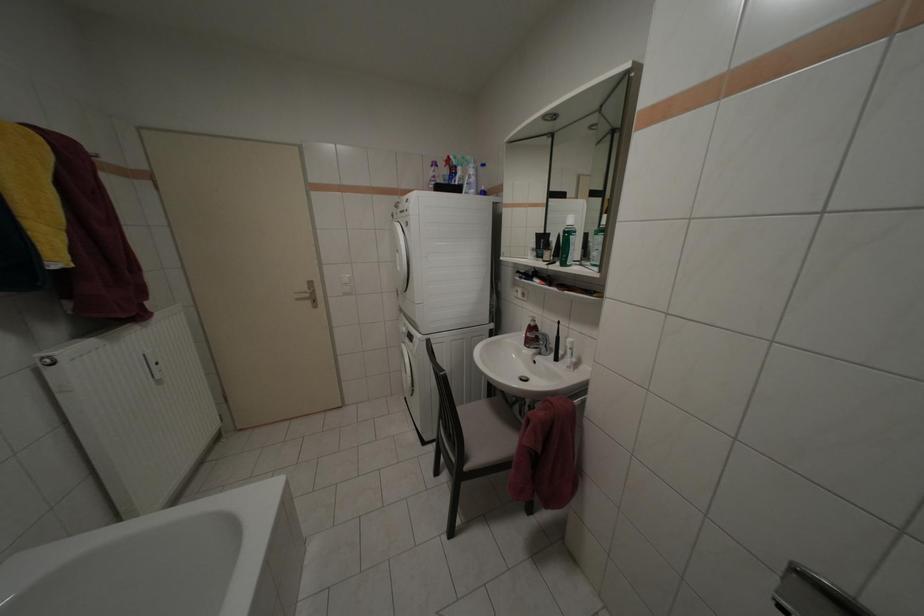
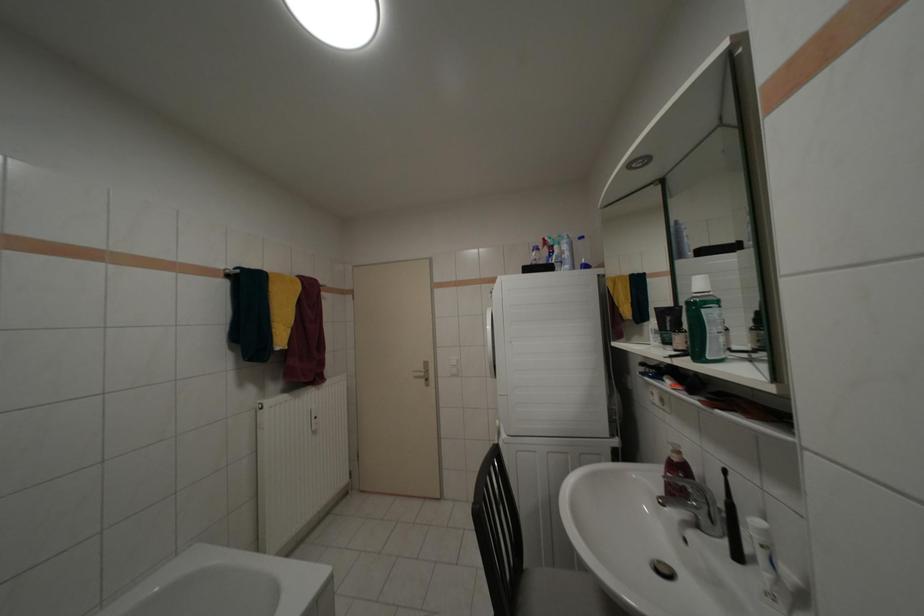
The images are taken continuously from a first-person perspective. In which direction is your viewpoint rotating?

The camera rotated toward left-up.